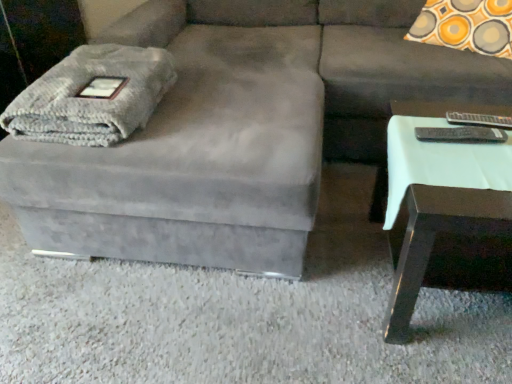
The image size is (512, 384). I want to click on suede gray couch at center, so point(238,130).

Image resolution: width=512 pixels, height=384 pixels. Describe the element at coordinates (448, 202) in the screenshot. I see `white glossy side table at right` at that location.

Describe the element at coordinates (466, 26) in the screenshot. I see `orange-yellow circle-patterned pillow at upper right` at that location.

Locate an element on the screen. suede gray couch at center is located at coordinates (238, 130).

Could you measure the distance between orange-yellow circle-patterned pillow at upper right and white glossy side table at right?

orange-yellow circle-patterned pillow at upper right and white glossy side table at right are 3.29 feet apart from each other.

Is orange-yellow circle-patterned pillow at upper right closer to the viewer compared to white glossy side table at right?

No, it is behind white glossy side table at right.

From a real-world perspective, is orange-yellow circle-patterned pillow at upper right physically above white glossy side table at right?

Yes, from a real-world perspective, orange-yellow circle-patterned pillow at upper right is on top of white glossy side table at right.

Is orange-yellow circle-patterned pillow at upper right to the right of white glossy side table at right from the viewer's perspective?

Indeed, orange-yellow circle-patterned pillow at upper right is positioned on the right side of white glossy side table at right.

Between orange-yellow circle-patterned pillow at upper right and gray knitted blanket at left, which one has smaller size?

Smaller between the two is gray knitted blanket at left.

Is orange-yellow circle-patterned pillow at upper right far away from gray knitted blanket at left?

orange-yellow circle-patterned pillow at upper right is far away from gray knitted blanket at left.

From the image's perspective, which is below, orange-yellow circle-patterned pillow at upper right or gray knitted blanket at left?

gray knitted blanket at left.

From a real-world perspective, is orange-yellow circle-patterned pillow at upper right on top of gray knitted blanket at left?

No.

From the image's perspective, between suede gray couch at center and white glossy side table at right, who is located below?

white glossy side table at right.

Based on their sizes in the image, would you say suede gray couch at center is bigger or smaller than white glossy side table at right?

Considering their sizes, suede gray couch at center takes up more space than white glossy side table at right.

Choose the correct answer: Is suede gray couch at center inside white glossy side table at right or outside it?

suede gray couch at center is not inside white glossy side table at right, it's outside.

Is suede gray couch at center further to the viewer compared to white glossy side table at right?

No, suede gray couch at center is closer to the viewer.

Can you confirm if white glossy side table at right is shorter than gray knitted blanket at left?

Incorrect, the height of white glossy side table at right does not fall short of that of gray knitted blanket at left.

Considering the relative positions of white glossy side table at right and gray knitted blanket at left in the image provided, is white glossy side table at right to the left or to the right of gray knitted blanket at left?

white glossy side table at right is positioned on gray knitted blanket at left's right side.

From the image's perspective, is white glossy side table at right above or below gray knitted blanket at left?

Based on their image positions, white glossy side table at right is located beneath gray knitted blanket at left.

Is white glossy side table at right positioned with its back to gray knitted blanket at left?

No, white glossy side table at right is not facing the opposite direction of gray knitted blanket at left.

Is orange-yellow circle-patterned pillow at upper right located outside suede gray couch at center?

No, orange-yellow circle-patterned pillow at upper right is not entirely external to suede gray couch at center.

Which is more to the left, orange-yellow circle-patterned pillow at upper right or suede gray couch at center?

Positioned to the left is suede gray couch at center.

Which is less distant, (x=469, y=5) or (x=186, y=43)?

Point (x=469, y=5) is closer to the camera than point (x=186, y=43).

From a real-world perspective, does orange-yellow circle-patterned pillow at upper right stand above suede gray couch at center?

Yes, from a real-world perspective, orange-yellow circle-patterned pillow at upper right is above suede gray couch at center.

Does white glossy side table at right have a greater width compared to suede gray couch at center?

In fact, white glossy side table at right might be narrower than suede gray couch at center.

Which is more to the left, white glossy side table at right or suede gray couch at center?

suede gray couch at center is more to the left.

How distant is white glossy side table at right from suede gray couch at center?

white glossy side table at right is 20.92 inches from suede gray couch at center.

From a real-world perspective, is white glossy side table at right located higher than suede gray couch at center?

No, from a real-world perspective, white glossy side table at right is not above suede gray couch at center.

Does white glossy side table at right have a larger size compared to orange-yellow circle-patterned pillow at upper right?

Actually, white glossy side table at right might be smaller than orange-yellow circle-patterned pillow at upper right.

Is the depth of white glossy side table at right greater than that of orange-yellow circle-patterned pillow at upper right?

No.

Find the location of a particular element. The image size is (512, 384). side table in front of the orange-yellow circle-patterned pillow at upper right is located at coordinates (448, 202).

Is white glossy side table at right located outside orange-yellow circle-patterned pillow at upper right?

white glossy side table at right lies outside orange-yellow circle-patterned pillow at upper right's area.

Where is `throw pillow on the right side of white glossy side table at right`? The height and width of the screenshot is (384, 512). throw pillow on the right side of white glossy side table at right is located at coordinates (466, 26).

This screenshot has height=384, width=512. I want to click on blanket located below the orange-yellow circle-patterned pillow at upper right (from the image's perspective), so click(x=92, y=96).

From the image, which object appears to be nearer to orange-yellow circle-patterned pillow at upper right, white glossy side table at right or suede gray couch at center?

The object closer to orange-yellow circle-patterned pillow at upper right is suede gray couch at center.

From the image, which object appears to be farther from gray knitted blanket at left, orange-yellow circle-patterned pillow at upper right or white glossy side table at right?

The object further to gray knitted blanket at left is orange-yellow circle-patterned pillow at upper right.

Looking at the image, which one is located closer to orange-yellow circle-patterned pillow at upper right, suede gray couch at center or gray knitted blanket at left?

suede gray couch at center.

Estimate the real-world distances between objects in this image. Which object is further from white glossy side table at right, suede gray couch at center or gray knitted blanket at left?

gray knitted blanket at left is positioned further to the anchor white glossy side table at right.

Based on their spatial positions, is orange-yellow circle-patterned pillow at upper right or gray knitted blanket at left closer to suede gray couch at center?

The object closer to suede gray couch at center is gray knitted blanket at left.

From the image, which object appears to be nearer to gray knitted blanket at left, orange-yellow circle-patterned pillow at upper right or suede gray couch at center?

suede gray couch at center is positioned closer to the anchor gray knitted blanket at left.

From the image, which object appears to be nearer to white glossy side table at right, orange-yellow circle-patterned pillow at upper right or suede gray couch at center?

Among the two, suede gray couch at center is located nearer to white glossy side table at right.

Considering their positions, is suede gray couch at center positioned closer to gray knitted blanket at left than white glossy side table at right?

Based on the image, suede gray couch at center appears to be nearer to gray knitted blanket at left.

Image resolution: width=512 pixels, height=384 pixels. I want to click on side table between suede gray couch at center and orange-yellow circle-patterned pillow at upper right along the z-axis, so click(x=448, y=202).

Locate an element on the screen. The height and width of the screenshot is (384, 512). studio couch situated between gray knitted blanket at left and white glossy side table at right from left to right is located at coordinates (238, 130).

Where is `side table between gray knitted blanket at left and orange-yellow circle-patterned pillow at upper right in the horizontal direction`? This screenshot has width=512, height=384. side table between gray knitted blanket at left and orange-yellow circle-patterned pillow at upper right in the horizontal direction is located at coordinates (448, 202).

This screenshot has width=512, height=384. I want to click on studio couch located between gray knitted blanket at left and orange-yellow circle-patterned pillow at upper right in the left-right direction, so click(x=238, y=130).